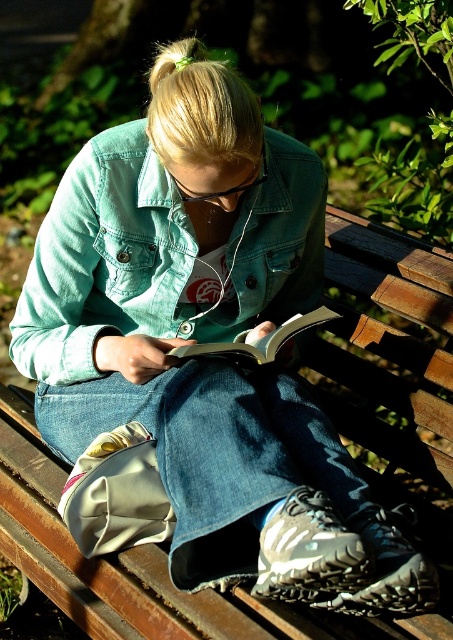
Is point (104, 268) closer to viewer compared to point (246, 348)?

No, it is not.

Does denim jacket at center come behind hardcover book at center?

No, it is in front of hardcover book at center.

Identify the location of denim jacket at center. (101, 259).